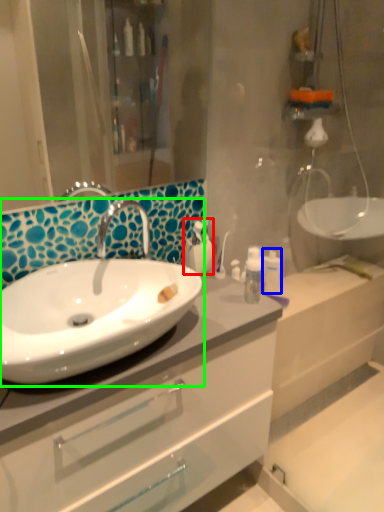
Question: Estimate the real-world distances between objects in this image. Which object is farther from toiletry (highlighted by a red box), toiletry (highlighted by a blue box) or sink (highlighted by a green box)?

Choices:
 (A) toiletry
 (B) sink

Answer: (B)